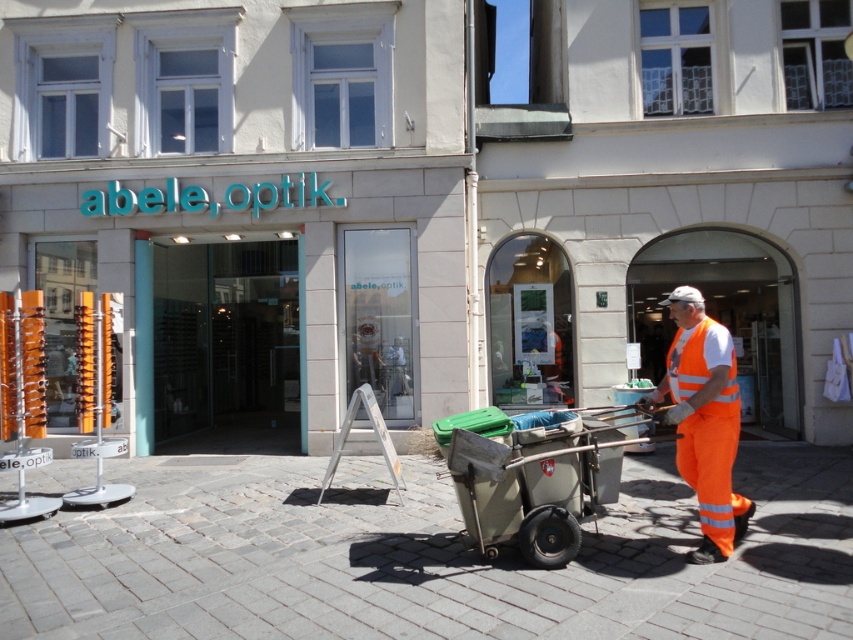
Describe the element at coordinates (426, 557) in the screenshot. Image resolution: width=853 pixels, height=640 pixels. I see `brick paved at center` at that location.

Measure the distance between point (117, 593) and camera.

Point (117, 593) is 5.51 meters from camera.

Locate an element on the screen. The image size is (853, 640). brick paved at center is located at coordinates (426, 557).

You are a GUI agent. You are given a task and a screenshot of the screen. Output one action in this format:
    pyautogui.click(x=<x>, y=<y>)
    Task: Click on the metallic gray cart at center
    This screenshot has width=853, height=640.
    Given the screenshot: What is the action you would take?
    pyautogui.click(x=537, y=483)

Does metallic gray cart at center have a larger size compared to orange reflective safety vest at right?

Correct, metallic gray cart at center is larger in size than orange reflective safety vest at right.

Is point (598, 413) behind point (733, 408)?

Yes, point (598, 413) is behind point (733, 408).

This screenshot has height=640, width=853. I want to click on metallic gray cart at center, so click(537, 483).

Between metallic gray cart at center and high visibility orange jumpsuit at center, which one is positioned higher?

high visibility orange jumpsuit at center is above.

Is metallic gray cart at center below high visibility orange jumpsuit at center?

Correct, metallic gray cart at center is located below high visibility orange jumpsuit at center.

This screenshot has height=640, width=853. Find the location of `metallic gray cart at center`. metallic gray cart at center is located at coordinates (537, 483).